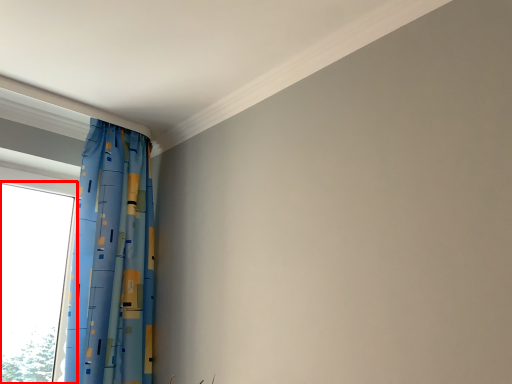
Question: From the image's perspective, what is the correct spatial positioning of window (annotated by the red box) in reference to curtain?

Choices:
 (A) above
 (B) below

Answer: (B)